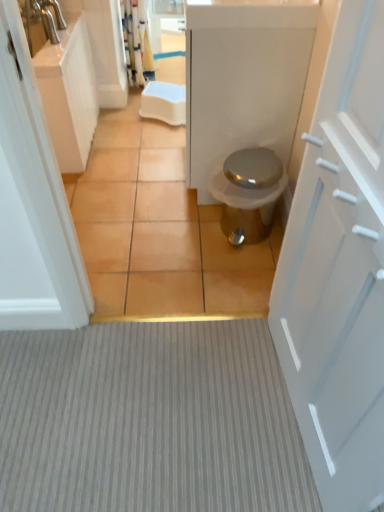
Describe the element at coordinates (248, 193) in the screenshot. I see `satin silver trash can at center` at that location.

This screenshot has height=512, width=384. Describe the element at coordinates (69, 94) in the screenshot. I see `white glossy cabinet at left` at that location.

What do you see at coordinates (251, 14) in the screenshot? The image size is (384, 512). I see `white glossy counter top at upper center` at bounding box center [251, 14].

The width and height of the screenshot is (384, 512). I want to click on metallic silver trash can at center, so click(244, 78).

The width and height of the screenshot is (384, 512). Describe the element at coordinates (339, 271) in the screenshot. I see `white matte door at right` at that location.

Image resolution: width=384 pixels, height=512 pixels. I want to click on brown tile at center, so click(159, 229).

Where is `plain behind the white matte door at right`? This screenshot has width=384, height=512. plain behind the white matte door at right is located at coordinates (149, 420).

Is gray textured carpet at center oriented away from white matte door at right?

gray textured carpet at center is not turned away from white matte door at right.

Considering the relative sizes of gray textured carpet at center and white matte door at right in the image provided, is gray textured carpet at center bigger than white matte door at right?

No.

Looking at this image, from the image's perspective, relative to white matte door at right, is gray textured carpet at center above or below?

Clearly, from the image's perspective, gray textured carpet at center is below white matte door at right.

Considering the positions of objects satin silver trash can at center and white matte door at right in the image provided, who is more to the left, satin silver trash can at center or white matte door at right?

Positioned to the left is satin silver trash can at center.

From a real-world perspective, which is physically above, satin silver trash can at center or white matte door at right?

white matte door at right, from a real-world perspective.

In the scene shown: Does satin silver trash can at center have a larger size compared to white matte door at right?

Actually, satin silver trash can at center might be smaller than white matte door at right.

How different are the orientations of satin silver trash can at center and white matte door at right in degrees?

There is a 4.09-degree angle between the facing directions of satin silver trash can at center and white matte door at right.

From a real-world perspective, who is located higher, satin silver trash can at center or gray textured carpet at center?

satin silver trash can at center is physically above.

Can you tell me how much satin silver trash can at center and gray textured carpet at center differ in facing direction?

The facing directions of satin silver trash can at center and gray textured carpet at center are 91.3 degrees apart.

Is satin silver trash can at center facing towards gray textured carpet at center?

No.

Is satin silver trash can at center placed right next to gray textured carpet at center?

No, satin silver trash can at center is not in contact with gray textured carpet at center.

From the image's perspective, is gray textured carpet at center located beneath white glossy counter top at upper center?

Correct, gray textured carpet at center appears lower than white glossy counter top at upper center in the image.

Is gray textured carpet at center taller than white glossy counter top at upper center?

Incorrect, the height of gray textured carpet at center is not larger of that of white glossy counter top at upper center.

Between gray textured carpet at center and white glossy counter top at upper center, which one appears on the right side from the viewer's perspective?

From the viewer's perspective, white glossy counter top at upper center appears more on the right side.

Is gray textured carpet at center with white glossy counter top at upper center?

No, gray textured carpet at center is not next to white glossy counter top at upper center.

Which of these two, white matte door at right or gray textured carpet at center, stands taller?

white matte door at right is taller.

From the image's perspective, is white matte door at right on gray textured carpet at center?

Yes.

Looking at their sizes, would you say white matte door at right is wider or thinner than gray textured carpet at center?

Considering their sizes, white matte door at right looks slimmer than gray textured carpet at center.

Does white matte door at right touch gray textured carpet at center?

They are not placed beside each other.

Which is behind, white matte door at right or white glossy counter top at upper center?

white glossy counter top at upper center is further away from the camera.

How many degrees apart are the facing directions of white matte door at right and white glossy counter top at upper center?

The angle between the facing direction of white matte door at right and the facing direction of white glossy counter top at upper center is 4.09 degrees.

Would you say white matte door at right is a long distance from white glossy counter top at upper center?

That's not correct — white matte door at right is a little close to white glossy counter top at upper center.

How far apart are white matte door at right and white glossy counter top at upper center?

white matte door at right is 34.64 inches away from white glossy counter top at upper center.

From the image's perspective, is white glossy counter top at upper center on white glossy cabinet at left?

Correct, white glossy counter top at upper center appears higher than white glossy cabinet at left in the image.

Is white glossy counter top at upper center in contact with white glossy cabinet at left?

No.

Choose the correct answer: Is white glossy counter top at upper center inside white glossy cabinet at left or outside it?

white glossy counter top at upper center is not inside white glossy cabinet at left, it's outside.

Who is bigger, white glossy counter top at upper center or white glossy cabinet at left?

white glossy cabinet at left is bigger.

Locate an element on the screen. This screenshot has width=384, height=512. door lying above the gray textured carpet at center (from the image's perspective) is located at coordinates (339, 271).

There is a satin silver trash can at center. At what (x,y) coordinates should I click in order to perform the action: click on door above it (from a real-world perspective). Please return your answer as a coordinate pair (x, y). The height and width of the screenshot is (512, 384). Looking at the image, I should click on (339, 271).

From the image, which object appears to be farther from white glossy cabinet at left, white glossy counter top at upper center or brown tile at center?

Based on the image, white glossy counter top at upper center appears to be further to white glossy cabinet at left.

Based on their spatial positions, is white matte door at right or brown tile at center closer to white glossy counter top at upper center?

brown tile at center.

Looking at the image, which one is located further to brown tile at center, white matte door at right or satin silver trash can at center?

Based on the image, white matte door at right appears to be further to brown tile at center.

Estimate the real-world distances between objects in this image. Which object is further from white glossy counter top at upper center, gray textured carpet at center or white glossy cabinet at left?

gray textured carpet at center is positioned further to the anchor white glossy counter top at upper center.

Looking at the image, which one is located closer to satin silver trash can at center, metallic silver trash can at center or white glossy counter top at upper center?

metallic silver trash can at center is closer to satin silver trash can at center.

From the image, which object appears to be farther from metallic silver trash can at center, white glossy cabinet at left or satin silver trash can at center?

white glossy cabinet at left.

Based on their spatial positions, is gray textured carpet at center or brown tile at center further from white glossy cabinet at left?

The object further to white glossy cabinet at left is gray textured carpet at center.

Estimate the real-world distances between objects in this image. Which object is further from gray textured carpet at center, brown tile at center or white matte door at right?

white matte door at right is further to gray textured carpet at center.

Where is `bath between white glossy cabinet at left and white glossy counter top at upper center from left to right`? bath between white glossy cabinet at left and white glossy counter top at upper center from left to right is located at coordinates (244, 78).

In order to click on plain between white matte door at right and satin silver trash can at center from front to back in this screenshot , I will do `click(149, 420)`.

At what (x,y) coordinates should I click in order to perform the action: click on toilet positioned between white matte door at right and brown tile at center from near to far. Please return your answer as a coordinate pair (x, y). This screenshot has height=512, width=384. Looking at the image, I should click on (248, 193).

Find the location of a particular element. The height and width of the screenshot is (512, 384). toilet between white matte door at right and white glossy cabinet at left in the front-back direction is located at coordinates (248, 193).